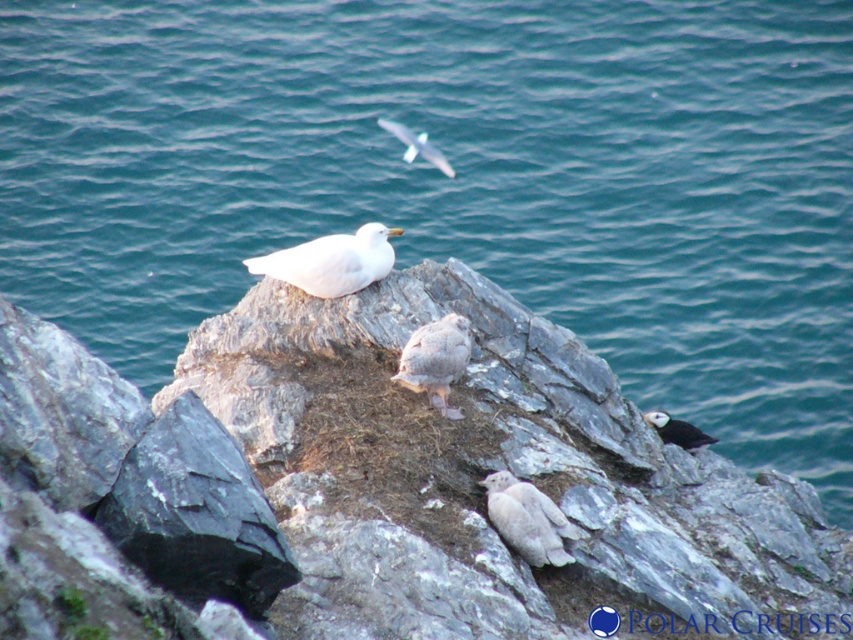
Is black fuzzy bird at lower right to the right of white feathered bird at upper center from the viewer's perspective?

Yes, black fuzzy bird at lower right is to the right of white feathered bird at upper center.

Which is behind, point (659, 433) or point (419, 134)?

Positioned behind is point (419, 134).

You are a GUI agent. You are given a task and a screenshot of the screen. Output one action in this format:
    pyautogui.click(x=<x>, y=<y>)
    Task: Click on the black fuzzy bird at lower right
    This screenshot has height=640, width=853.
    Given the screenshot: What is the action you would take?
    pyautogui.click(x=677, y=429)

Which is in front, point (322, 298) or point (421, 150)?

Point (322, 298) is more forward.

Who is positioned more to the left, white matte bird at upper center or white feathered bird at upper center?

white matte bird at upper center

Identify the location of white matte bird at upper center. The width and height of the screenshot is (853, 640). pos(332,260).

Does white matte bird at upper center have a greater height compared to black fuzzy bird at lower right?

Yes.

Which is below, white matte bird at upper center or black fuzzy bird at lower right?

Positioned lower is black fuzzy bird at lower right.

Is point (331, 257) more distant than point (663, 436)?

No, (331, 257) is in front of (663, 436).

Find the location of a particular element. Image resolution: width=853 pixels, height=640 pixels. white matte bird at upper center is located at coordinates point(332,260).